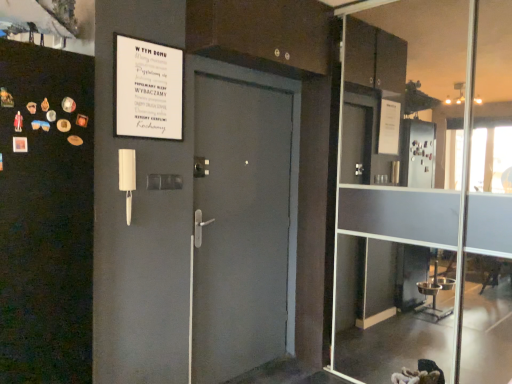
Question: From a real-world perspective, relative to transparent glass door at center, is white paper sign at upper left vertically above or below?

Choices:
 (A) above
 (B) below

Answer: (A)

Question: Is white paper sign at upper left in front of or behind transparent glass door at center in the image?

Choices:
 (A) behind
 (B) front

Answer: (A)

Question: Is white paper sign at upper left taller or shorter than transparent glass door at center?

Choices:
 (A) tall
 (B) short

Answer: (B)

Question: Is transparent glass door at center bigger or smaller than white paper sign at upper left?

Choices:
 (A) big
 (B) small

Answer: (A)

Question: In the image, is transparent glass door at center on the left side or the right side of white paper sign at upper left?

Choices:
 (A) left
 (B) right

Answer: (B)

Question: Is transparent glass door at center situated inside white paper sign at upper left or outside?

Choices:
 (A) outside
 (B) inside

Answer: (A)

Question: From a real-world perspective, is transparent glass door at center positioned above or below white paper sign at upper left?

Choices:
 (A) below
 (B) above

Answer: (A)